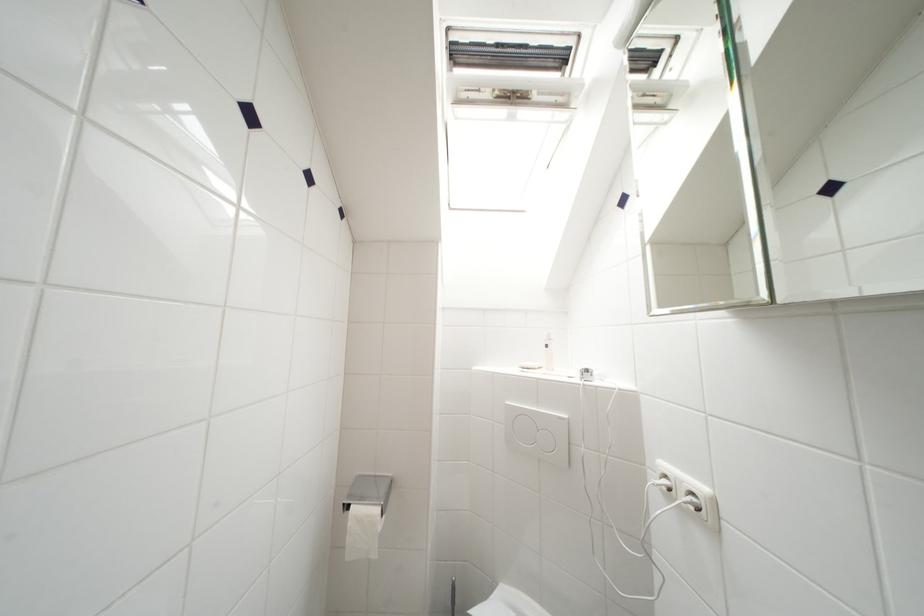
Where is `white bar of soap`? The width and height of the screenshot is (924, 616). white bar of soap is located at coordinates (530, 365).